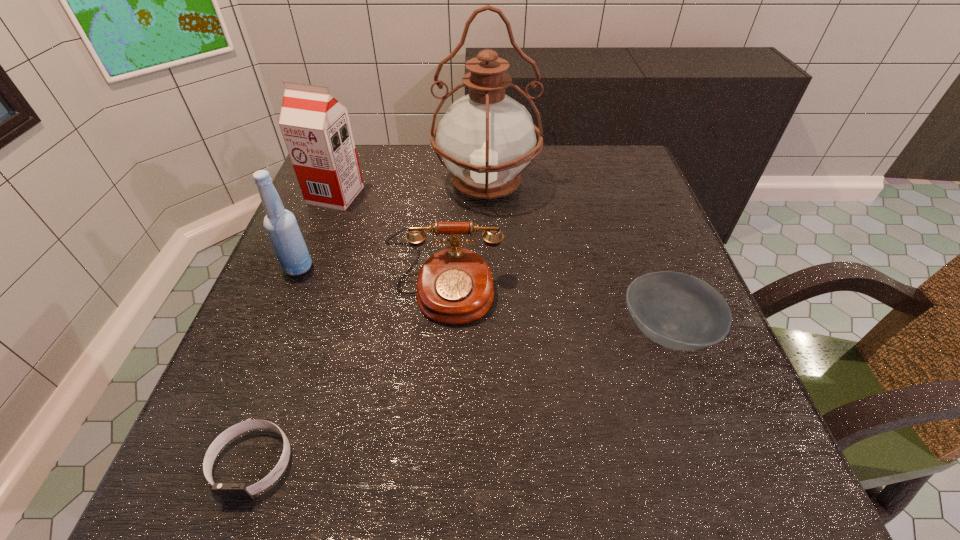
You are a GUI agent. You are given a task and a screenshot of the screen. Output one action in this format:
    pyautogui.click(x=<x>, y=<y>)
    Task: Click on the vacant region located on the right of the bottle
    The width and height of the screenshot is (960, 540).
    Given the screenshot: What is the action you would take?
    pyautogui.click(x=347, y=267)

Identify the location of free space located 0.200m on the dial of the telephone. The width and height of the screenshot is (960, 540). (435, 433).

Identify the location of vacant point located on the back of the bowl. (x=642, y=267).

Locate an element on the screen. The width and height of the screenshot is (960, 540). oil lamp that is at the far edge is located at coordinates (486, 138).

At what (x,y) coordinates should I click in order to perform the action: click on soya milk that is at the far edge. Please return your answer as a coordinate pair (x, y). This screenshot has height=540, width=960. Looking at the image, I should click on (316, 128).

What are the coordinates of `object situated at the near edge` in the screenshot? It's located at (227, 491).

You are a GUI agent. You are given a task and a screenshot of the screen. Output one action in this format:
    pyautogui.click(x=<x>, y=<y>)
    Task: Click on the soya milk present at the left edge
    This screenshot has width=960, height=540.
    Given the screenshot: What is the action you would take?
    pyautogui.click(x=316, y=128)

Image resolution: width=960 pixels, height=540 pixels. I want to click on bottle that is at the left edge, so click(281, 226).

This screenshot has width=960, height=540. I want to click on wristband at the left edge, so click(x=227, y=491).

The image size is (960, 540). I want to click on object that is at the right edge, so click(x=681, y=312).